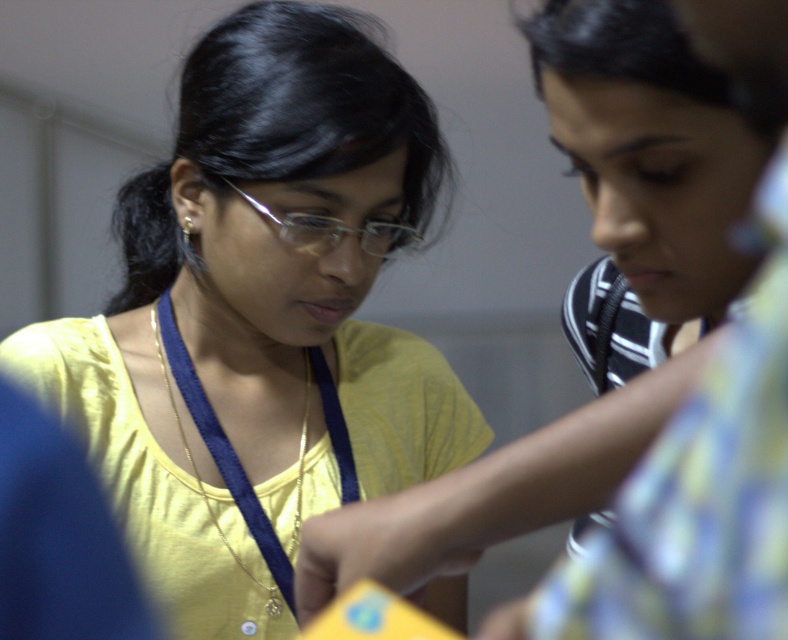
Can you confirm if yellow matte shirt at center is positioned above blue fabric at center?

Yes.

Between point (300, 304) and point (173, 328), which one is positioned in front?

Point (300, 304) is more forward.

Locate an element on the screen. The image size is (788, 640). yellow matte shirt at center is located at coordinates (259, 317).

Describe the element at coordinates (259, 317) in the screenshot. I see `yellow matte shirt at center` at that location.

Can you confirm if yellow matte shirt at center is positioned to the left of yellow fabric shirt at upper left?

Correct, you'll find yellow matte shirt at center to the left of yellow fabric shirt at upper left.

This screenshot has width=788, height=640. Describe the element at coordinates (259, 317) in the screenshot. I see `yellow matte shirt at center` at that location.

Find the location of `yellow matte shirt at center`. yellow matte shirt at center is located at coordinates (259, 317).

Measure the distance from yellow matte shirt at center to clear plastic glasses at center.

yellow matte shirt at center and clear plastic glasses at center are 11.86 centimeters apart from each other.

Can you confirm if yellow matte shirt at center is positioned below clear plastic glasses at center?

Correct, yellow matte shirt at center is located below clear plastic glasses at center.

Who is more distant from viewer, (292, 308) or (236, 192)?

The point (292, 308) is behind.

This screenshot has height=640, width=788. What are the coordinates of `yellow matte shirt at center` in the screenshot? It's located at (259, 317).